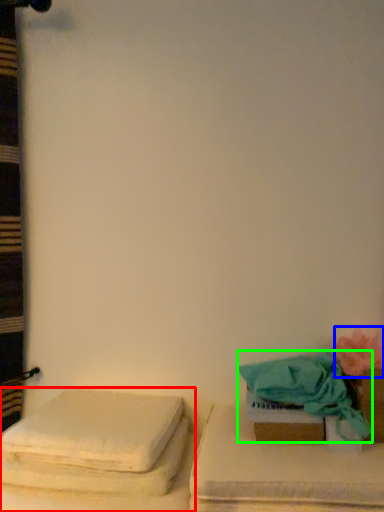
Question: Based on their relative distances, which object is farther from furniture (highlighted by a red box)? Choose from flower (highlighted by a blue box) and beach towel (highlighted by a green box).

Choices:
 (A) flower
 (B) beach towel

Answer: (A)